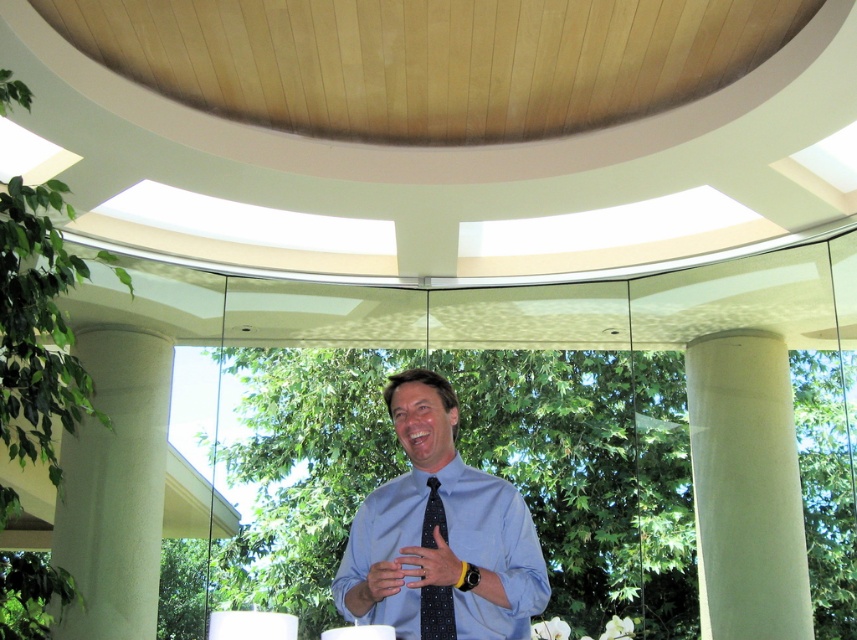
You are a photographer trying to capture the man in the scene. Since the blue polka dot tie at center and the smooth skin hand at center are both in focus, which one would appear larger in the photo?

The blue poloka dot tie at center would appear larger in the photo because it is bigger than the smooth skin hand at center.

You are standing in the modern architectural space and want to place a small plant between the two points, point (516, 531) and point (393, 561). Will the plant be closer to the glass walls or the ceiling?

The plant will be closer to the glass walls because point (516, 531) is closer to the viewer than point (393, 561), so the midpoint between them would be nearer to the glass walls.